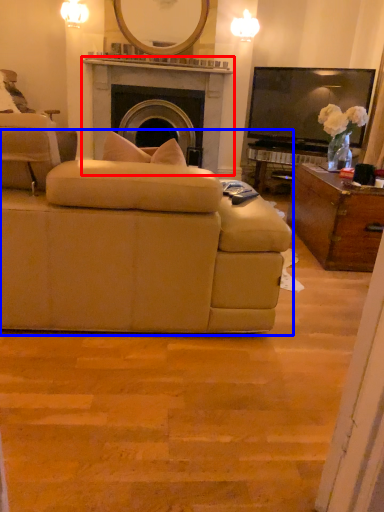
Question: Among these objects, which one is nearest to the camera, fireplace (highlighted by a red box) or studio couch (highlighted by a blue box)?

Choices:
 (A) fireplace
 (B) studio couch

Answer: (B)